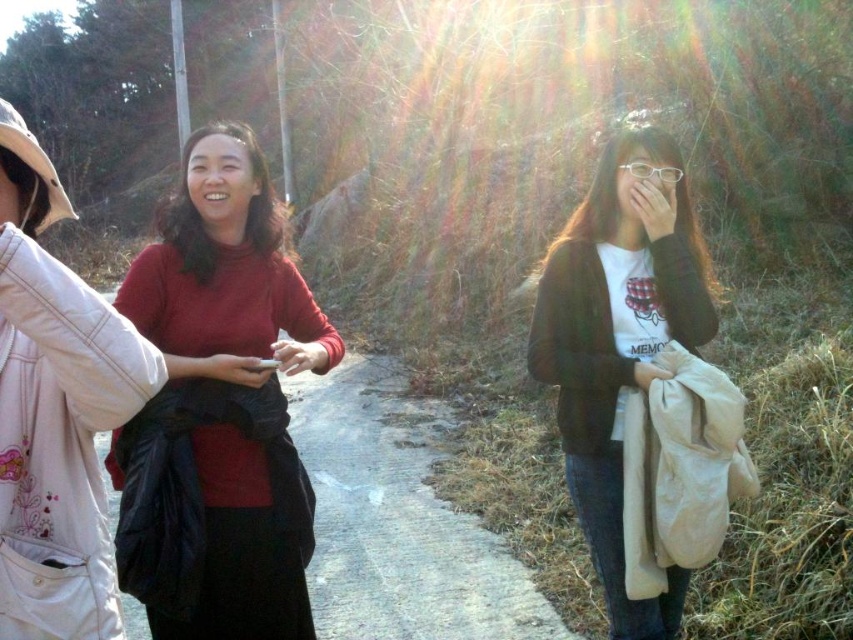
Looking at this image, does black fabric bag at center have a larger size compared to matte black cardigan at right?

No, black fabric bag at center is not bigger than matte black cardigan at right.

Does point (126, 598) come behind point (601, 563)?

That is True.

Image resolution: width=853 pixels, height=640 pixels. I want to click on black fabric bag at center, so click(398, 518).

Who is lower down, matte red sweater at center or matte black cardigan at right?

matte black cardigan at right is below.

Based on the photo, is matte red sweater at center positioned before matte black cardigan at right?

Yes.

Measure the distance between point (228, 273) and camera.

A distance of 7.31 feet exists between point (228, 273) and camera.

This screenshot has height=640, width=853. I want to click on matte red sweater at center, so click(219, 408).

Between matte red sweater at center and black fabric bag at center, which one has more height?

matte red sweater at center

Between matte red sweater at center and black fabric bag at center, which one appears on the right side from the viewer's perspective?

black fabric bag at center

Who is more distant from viewer, (229, 195) or (334, 576)?

Positioned behind is point (334, 576).

Locate an element on the screen. matte red sweater at center is located at coordinates (219, 408).